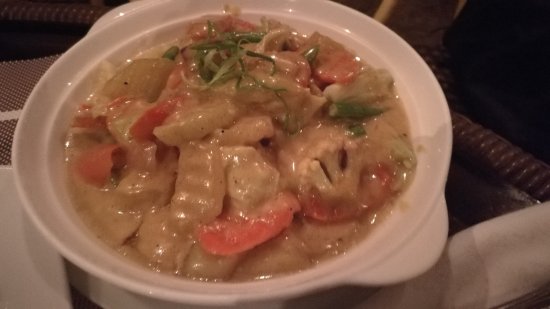
Where is `white table cloth`? white table cloth is located at coordinates (456, 278), (31, 250).